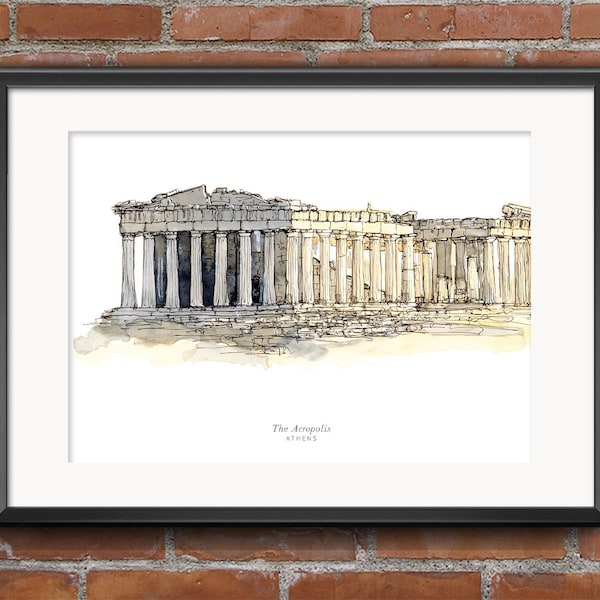
The image size is (600, 600). What are the coordinates of `white picture matting` in the screenshot? It's located at (393, 486), (297, 113), (46, 295), (570, 315).